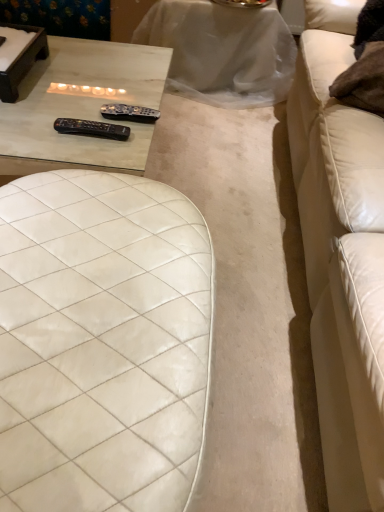
Locate an element on the screen. This screenshot has height=512, width=384. free location in front of black plastic remote at upper center, acting as the 2th remote starting from the front is located at coordinates (97, 156).